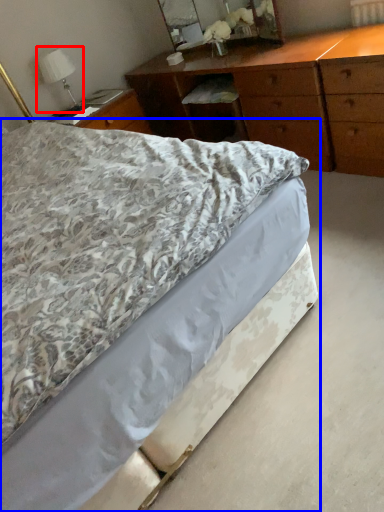
Question: Which object is further to the camera taking this photo, bedside lamp (highlighted by a red box) or bed (highlighted by a blue box)?

Choices:
 (A) bedside lamp
 (B) bed

Answer: (A)